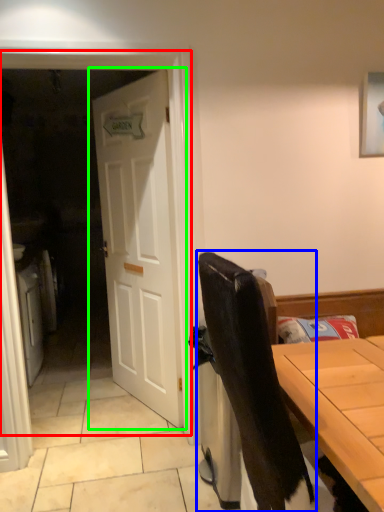
Question: Which is farther away from screen door (highlighted by a red box)? chair (highlighted by a blue box) or door (highlighted by a green box)?

Choices:
 (A) chair
 (B) door

Answer: (A)